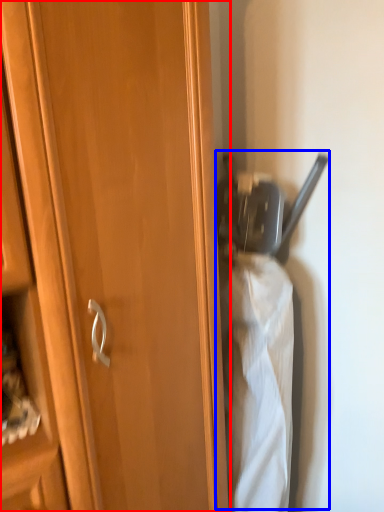
Question: Among these objects, which one is farthest to the camera, cupboard (highlighted by a red box) or wide (highlighted by a blue box)?

Choices:
 (A) cupboard
 (B) wide

Answer: (B)